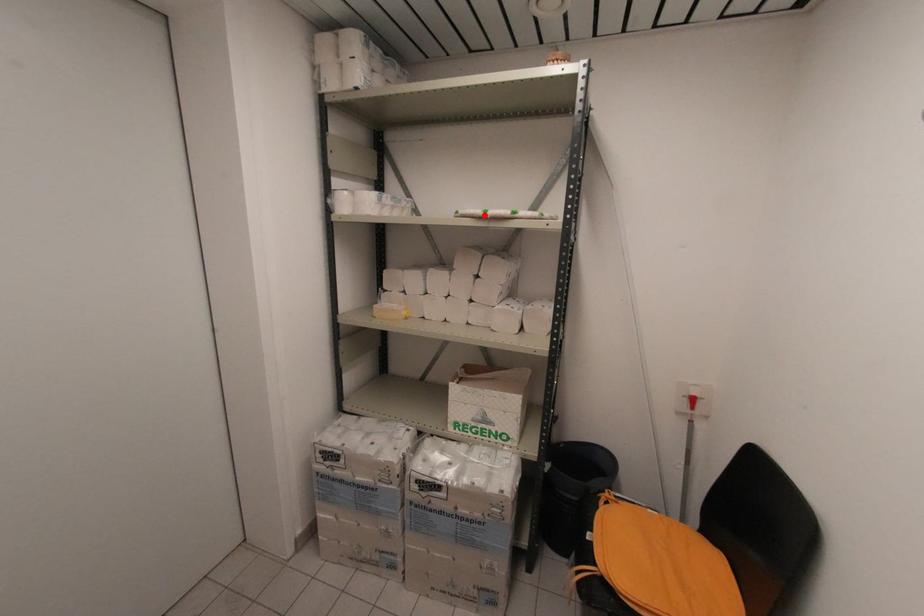
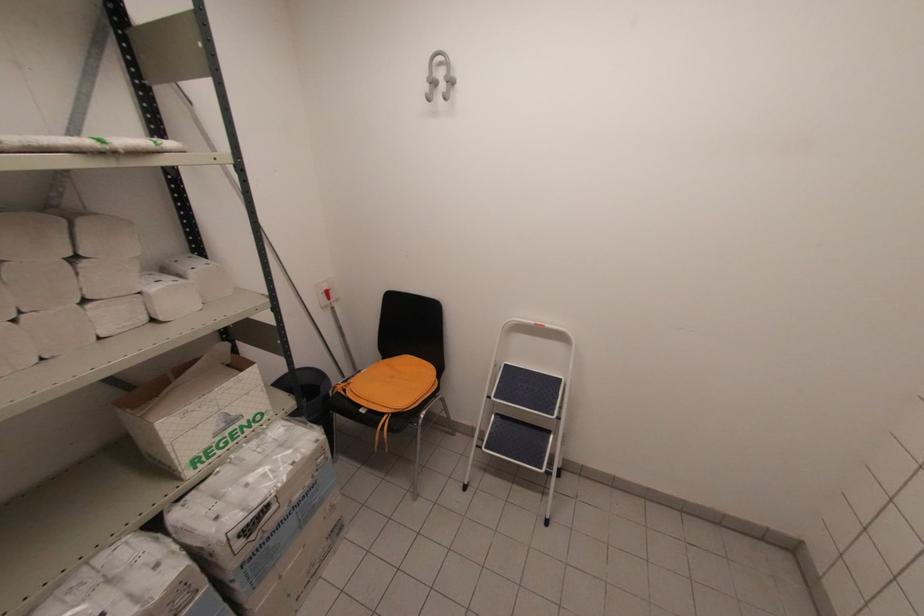
Question: I am providing you with two images of the same scene from different viewpoints. In image1, a red point is highlighted. Considering the same 3D point in image2, which of the following is correct?

Choices:
 (A) It is closer
 (B) It is farther

Answer: (B)